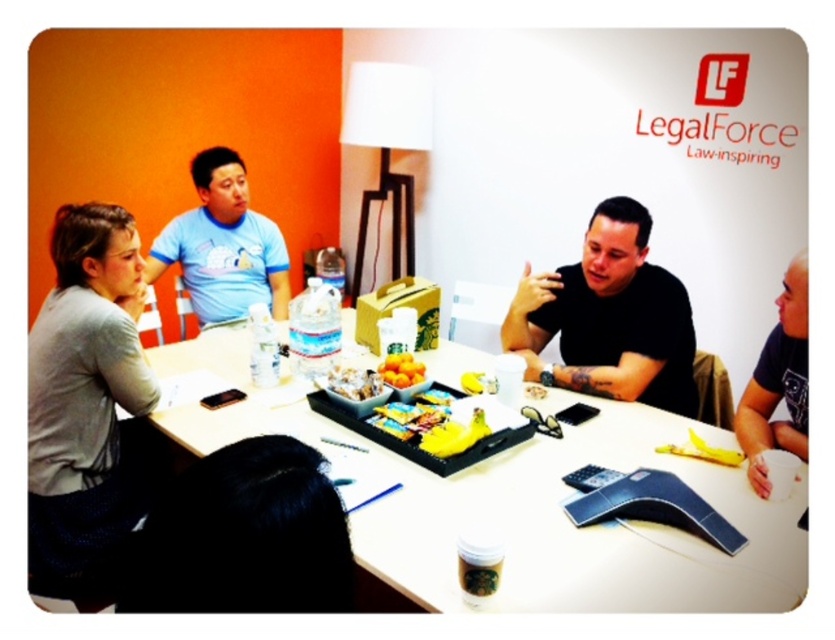
You are a server at a cafe and you need to place a 12 inch wide cake on the table. Can you fit it on the white glossy table at center without overlapping the gray fabric purse at lower left?

The white glossy table at center might be wider than gray fabric purse at lower left, so there is a possibility that the cake can fit, but it depends on the exact dimensions of the table and the placement of the purse.

You are a guest at this meeting and want to place your phone on the surface that is higher between the white glossy table at center and the white crumbly cake at center. Which surface should you choose?

The white glossy table at center has a greater height compared to the white crumbly cake at center, so you should place your phone on the white glossy table at center.

In the scene shown: You are standing in the room facing the LegalForce Law Inspiring logo on the white wall. Where is the white glossy table at center relative to the logo?

The white glossy table at center is located at point (522, 504) relative to the logo on the white wall.